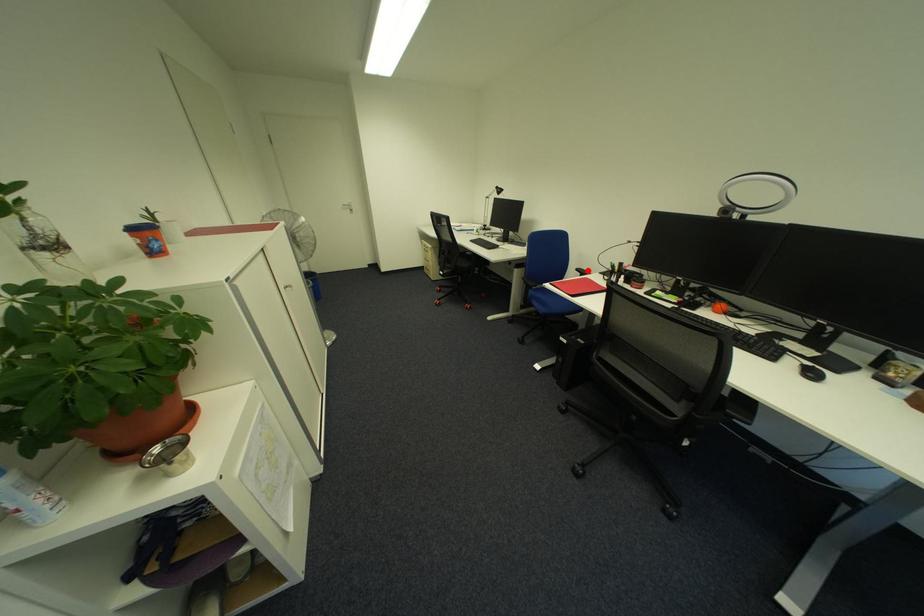
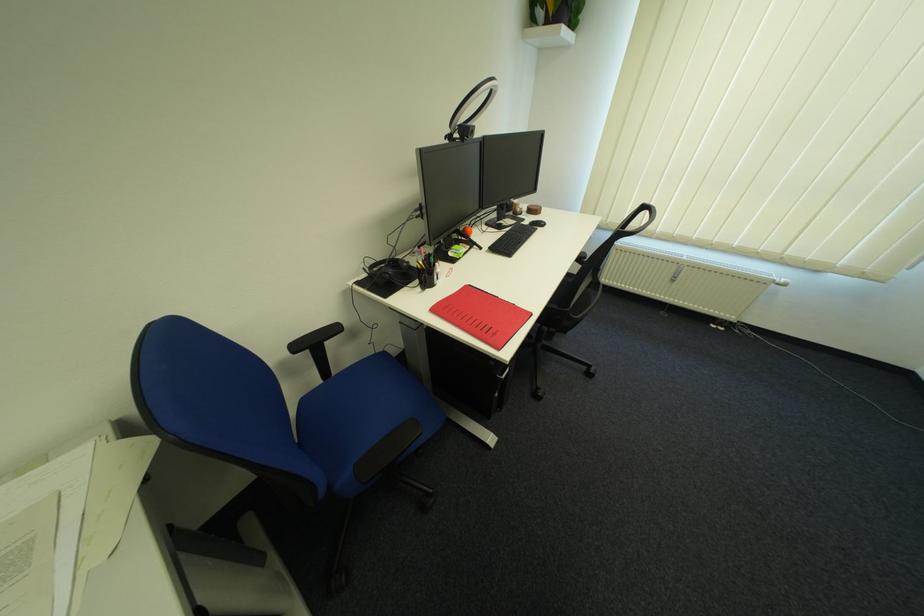
Question: I am providing you with two images of the same scene from different viewpoints. Image1 has a red point marked. In image2, the corresponding 3D location appears at what relative position? Reply with the corresponding letter.

Choices:
 (A) Closer
 (B) Farther

Answer: (B)